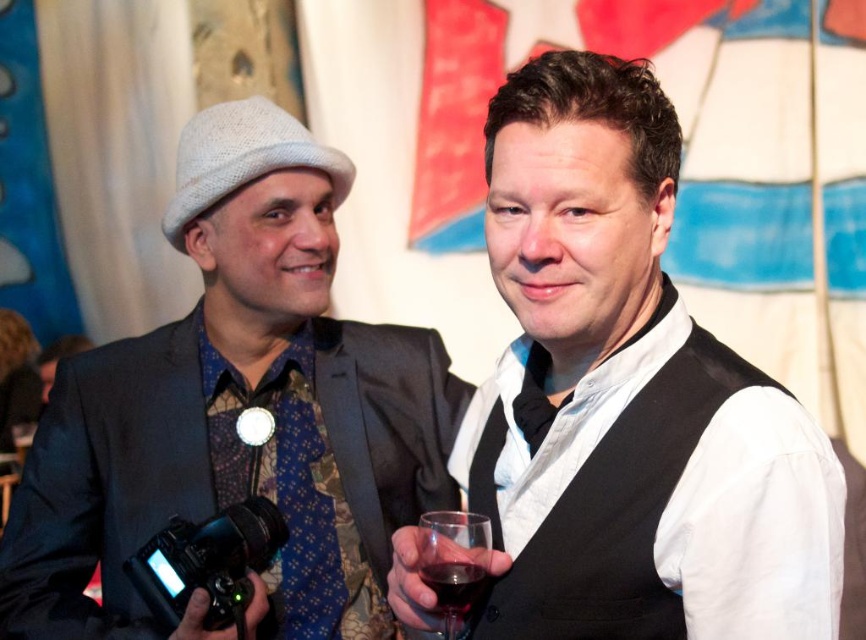
You are standing in the room and want to know which point is closer to you. The points are point (337, 188) and point (189, 538). Which one is closer?

Point (189, 538) is closer to you because it is less further than point (337, 188).

You are standing in the same room as the people in the image. If you want to take a photo of the black satin vest at right without including the person holding the camera, where should you position yourself relative to the vest?

To avoid including the person holding the camera in the photo, position yourself to the right side of the black satin vest at right, as the camera holder is on the left side of the vest.

You are at a social event and want to take a photo of the two people standing near the abstract art wall. The photographer is holding a camera at point (x=554, y=592) and the other person is at point (x=540, y=429). Which point is closer to you if you are facing the wall?

Point (x=554, y=592) is in front of point (x=540, y=429), so the photographer holding the camera at point (x=554, y=592) is closer to you.